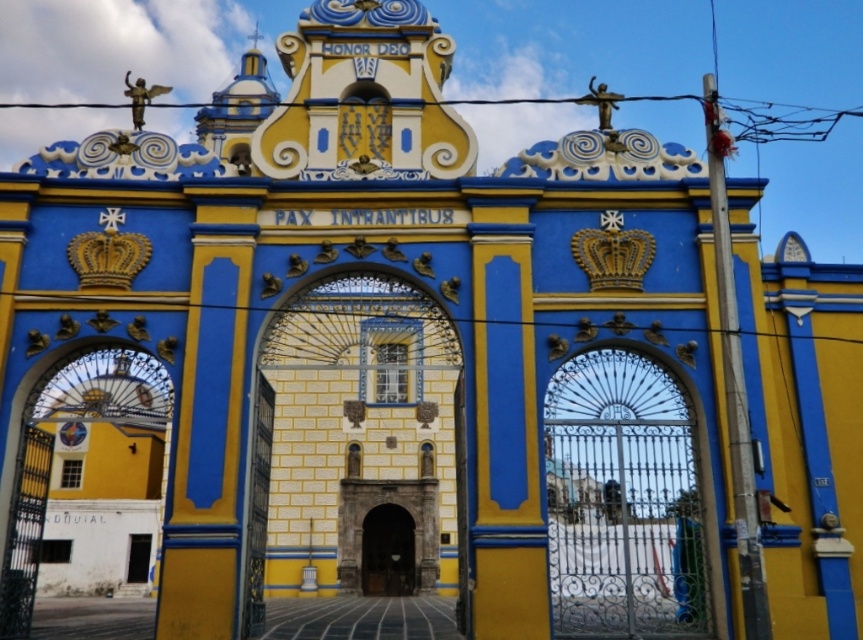
Which of these two, smooth wood door at center or dark wood door at center, stands taller?

smooth wood door at center

Measure the distance between smooth wood door at center and dark wood door at center.

smooth wood door at center is 34.02 meters from dark wood door at center.

Is point (253, 435) in front of point (405, 525)?

Yes, it is.

Locate an element on the screen. Image resolution: width=863 pixels, height=640 pixels. smooth wood door at center is located at coordinates (257, 508).